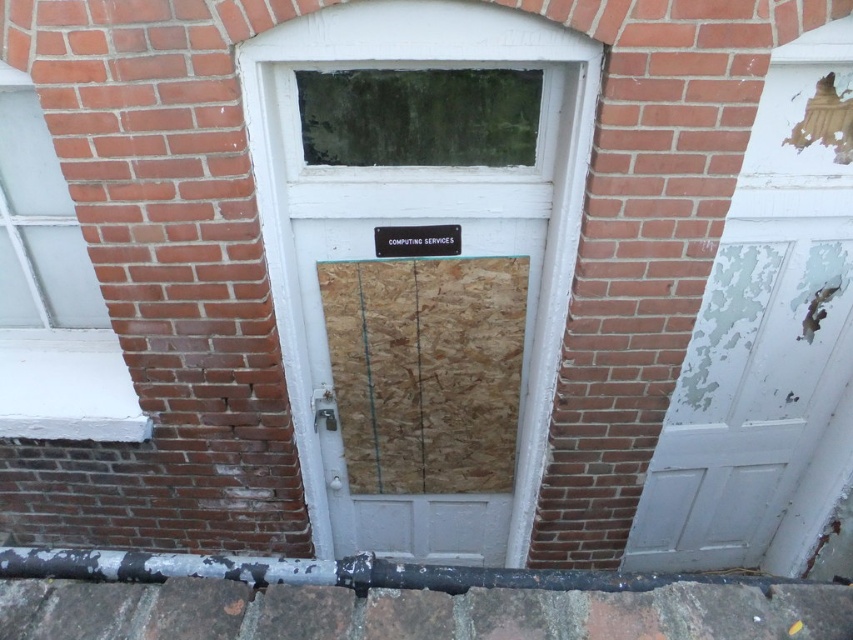
Between white painted glass at left and black plastic sign at center, which one has more height?

white painted glass at left

Can you confirm if white painted glass at left is positioned to the right of black plastic sign at center?

Incorrect, white painted glass at left is not on the right side of black plastic sign at center.

You are a GUI agent. You are given a task and a screenshot of the screen. Output one action in this format:
    pyautogui.click(x=<x>, y=<y>)
    Task: Click on the white painted glass at left
    This screenshot has width=853, height=640.
    Given the screenshot: What is the action you would take?
    pyautogui.click(x=51, y=296)

Who is more forward, (792, 561) or (61, 346)?

Positioned in front is point (61, 346).

Which is in front, point (819, 420) or point (93, 280)?

Point (93, 280)

Identify the location of white peeling paint door at right. (764, 339).

Can you confirm if white peeling paint door at right is smaller than black plastic sign at center?

No, white peeling paint door at right is not smaller than black plastic sign at center.

Between white peeling paint door at right and black plastic sign at center, which one appears on the left side from the viewer's perspective?

black plastic sign at center is more to the left.

Which is behind, point (761, 330) or point (384, 236)?

The point (761, 330) is more distant.

Locate an element on the screen. white peeling paint door at right is located at coordinates (764, 339).